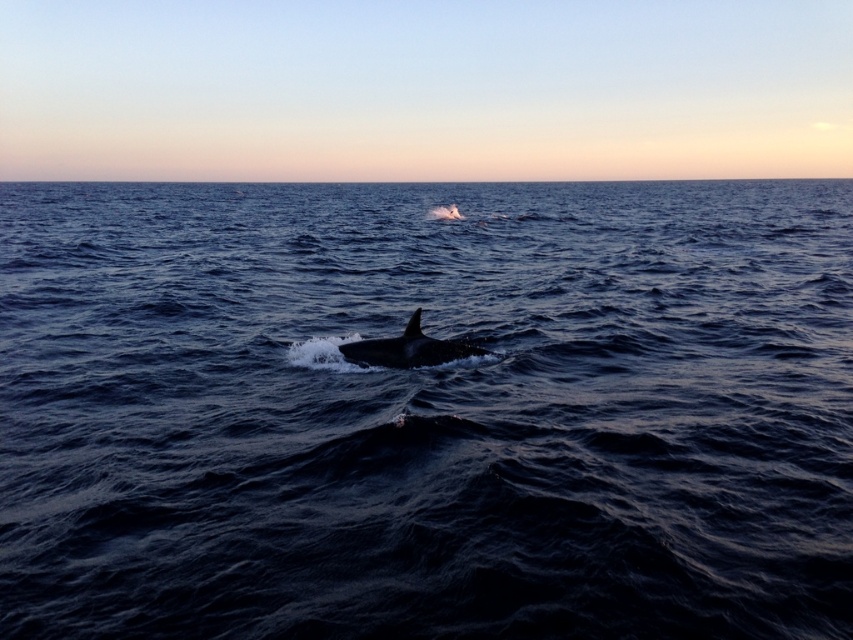
You are a marine biologist observing the ocean scene. You notice the dark blue water at center and the smooth gray whale at center. Which object occupies a larger area in the image?

The dark blue water at center is bigger than the smooth gray whale at center, so the dark blue water at center occupies a larger area in the image.

You are a marine biologist observing the ocean scene. You notice the dark blue water at center and the smooth gray whale at center. Which object appears closer to you in the image?

The dark blue water at center is closer to the viewer than the smooth gray whale at center.